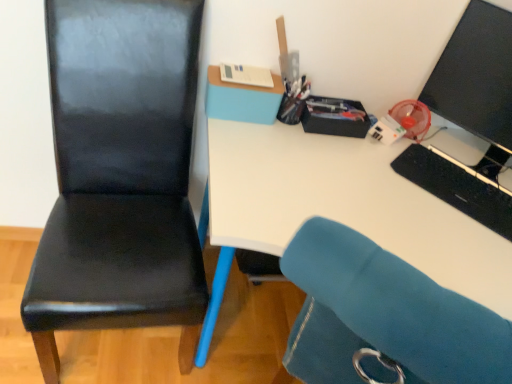
You are a GUI agent. You are given a task and a screenshot of the screen. Output one action in this format:
    pyautogui.click(x=<x>, y=<y>)
    Task: Click on the spots to the right of metallic pen holder at upper center, acting as the 2th stationery starting from the right
    
    Given the screenshot: What is the action you would take?
    340,150